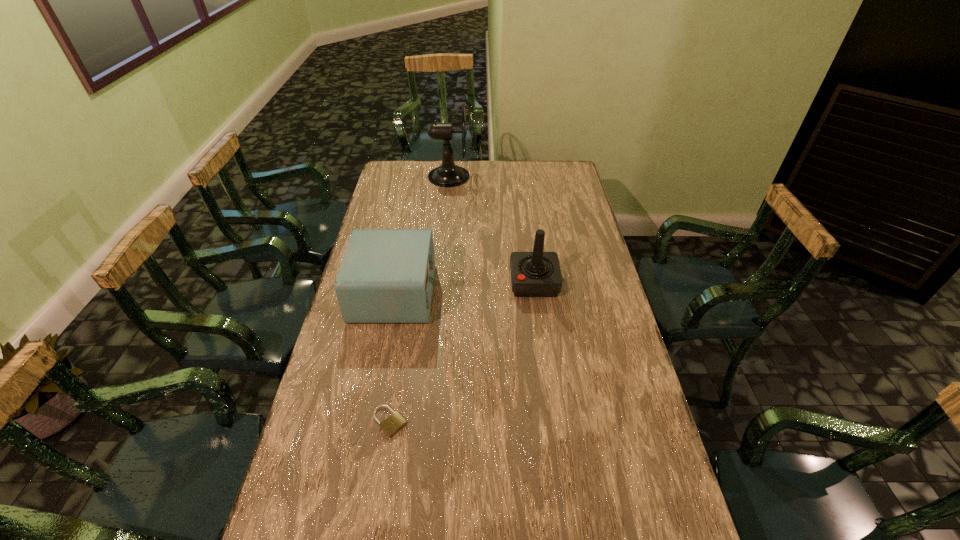
Locate an element on the screen. The width and height of the screenshot is (960, 540). vacant region that satisfies the following two spatial constraints: 1. on the front panel of the padlock; 2. on the left side of the radio receiver is located at coordinates (368, 422).

This screenshot has width=960, height=540. Find the location of `vacant space that satisfies the following two spatial constraints: 1. on the back side of the shortest object; 2. on the front panel of the second shortest object`. vacant space that satisfies the following two spatial constraints: 1. on the back side of the shortest object; 2. on the front panel of the second shortest object is located at coordinates (411, 293).